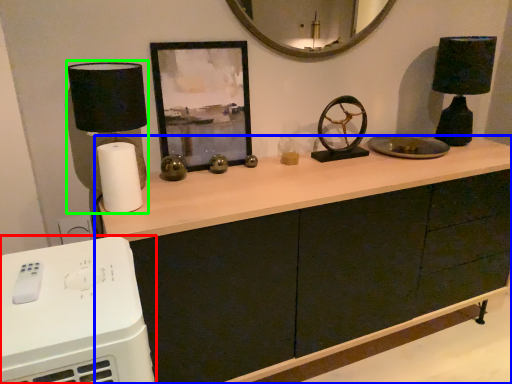
Question: Which is nearer to the home appliance (highlighted by a red box)? cabinetry (highlighted by a blue box) or table lamp (highlighted by a green box).

Choices:
 (A) cabinetry
 (B) table lamp

Answer: (B)